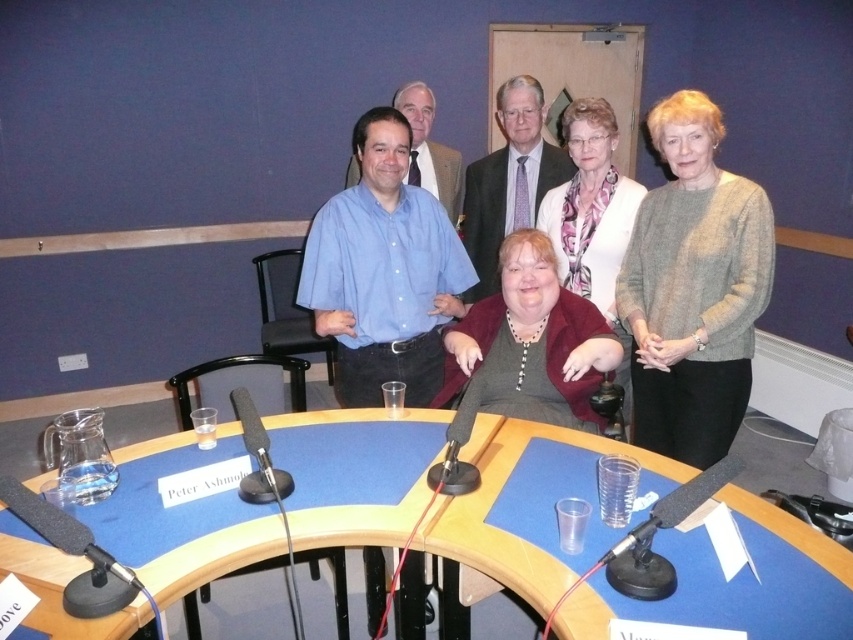
Is gray sweater at upper right smaller than blue fabric table at center?

No.

Can you confirm if gray sweater at upper right is taller than blue fabric table at center?

Indeed, gray sweater at upper right has a greater height compared to blue fabric table at center.

Which is behind, point (637, 384) or point (769, 579)?

Point (637, 384)

You are a GUI agent. You are given a task and a screenshot of the screen. Output one action in this format:
    pyautogui.click(x=<x>, y=<y>)
    Task: Click on the gray sweater at upper right
    
    Given the screenshot: What is the action you would take?
    pyautogui.click(x=693, y=289)

Is point (677, 614) closer to camera compared to point (521, 387)?

Yes.

Is point (724, 618) positioned after point (558, 328)?

No, it is in front of (558, 328).

You are a GUI agent. You are given a task and a screenshot of the screen. Output one action in this format:
    pyautogui.click(x=<x>, y=<y>)
    Task: Click on the blue fabric table at center
    The image size is (853, 640).
    Given the screenshot: What is the action you would take?
    pyautogui.click(x=752, y=579)

Is blue fabric table at center to the left of matte burgundy sweater at center from the viewer's perspective?

Indeed, blue fabric table at center is positioned on the left side of matte burgundy sweater at center.

Image resolution: width=853 pixels, height=640 pixels. In order to click on blue fabric table at center in this screenshot , I will do `click(752, 579)`.